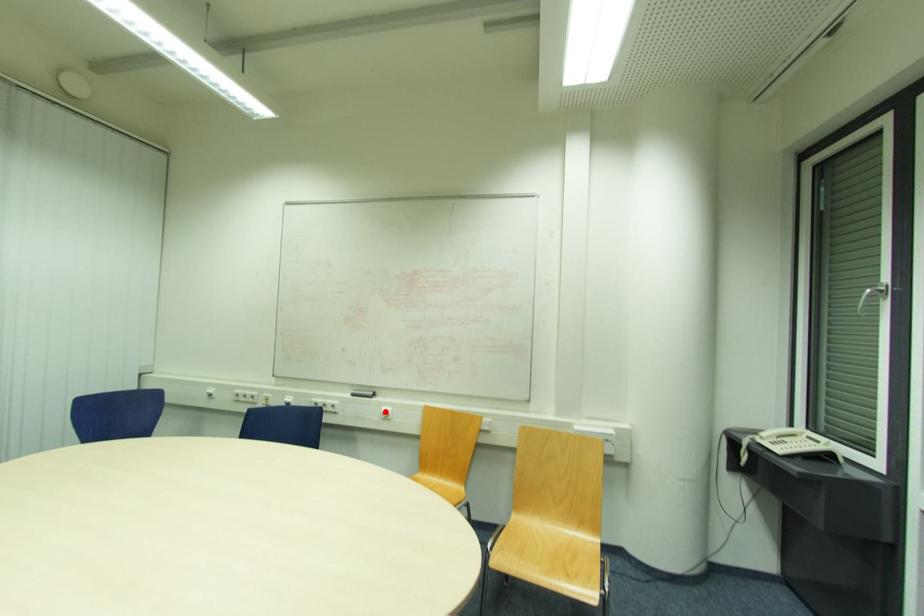
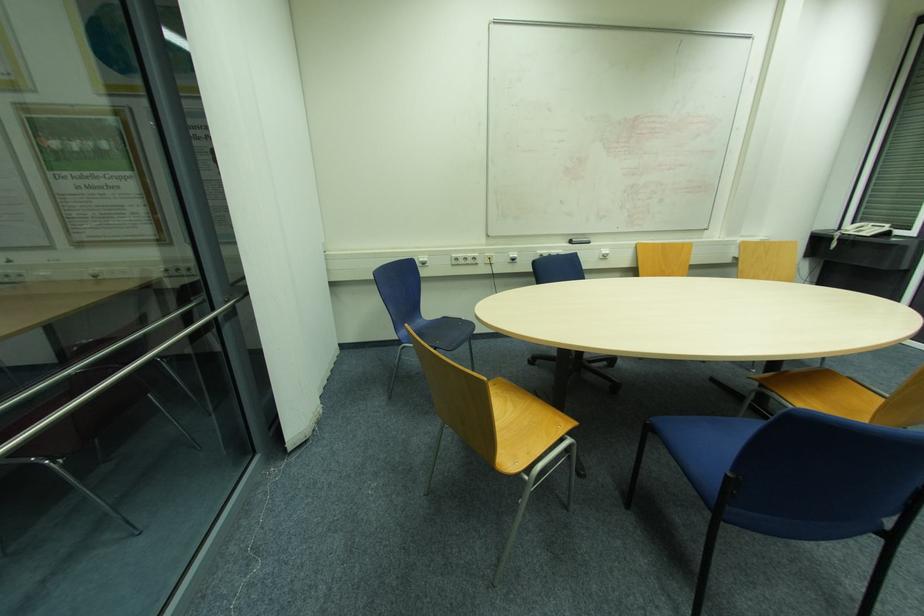
In the second image, find the point that corresponds to the highlighted location in the first image.

(604, 253)